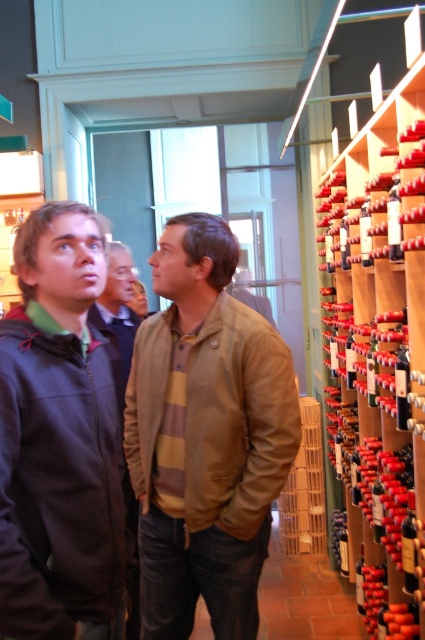
Is dark gray jacket at left closer to the viewer compared to translucent glass bottle at right?

Yes, dark gray jacket at left is in front of translucent glass bottle at right.

Is the position of dark gray jacket at left more distant than that of translucent glass bottle at right?

No, dark gray jacket at left is closer to the viewer.

Find the location of `dark gray jacket at left`. dark gray jacket at left is located at coordinates (59, 440).

Which is in front, point (90, 275) or point (419, 209)?

Positioned in front is point (90, 275).

Is point (51, 477) positioned before point (362, 556)?

Yes, point (51, 477) is closer to viewer.

Locate an element on the screen. Image resolution: width=425 pixels, height=640 pixels. brown leather jacket at center is located at coordinates (59, 440).

Is point (141, 305) closer to camera compared to point (388, 221)?

No, (141, 305) is behind (388, 221).

Image resolution: width=425 pixels, height=640 pixels. In order to click on dark brown leather jacket at center in this screenshot , I will do `click(118, 310)`.